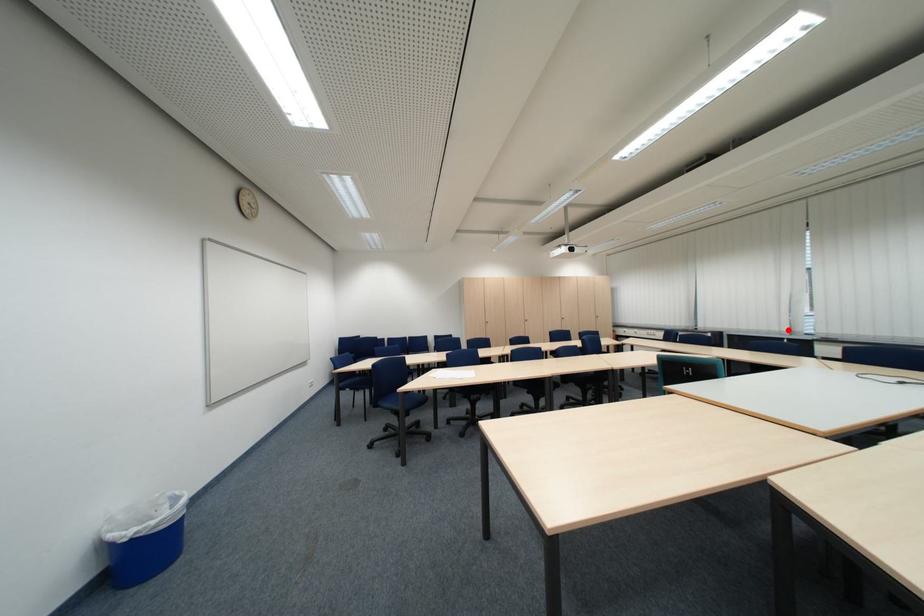
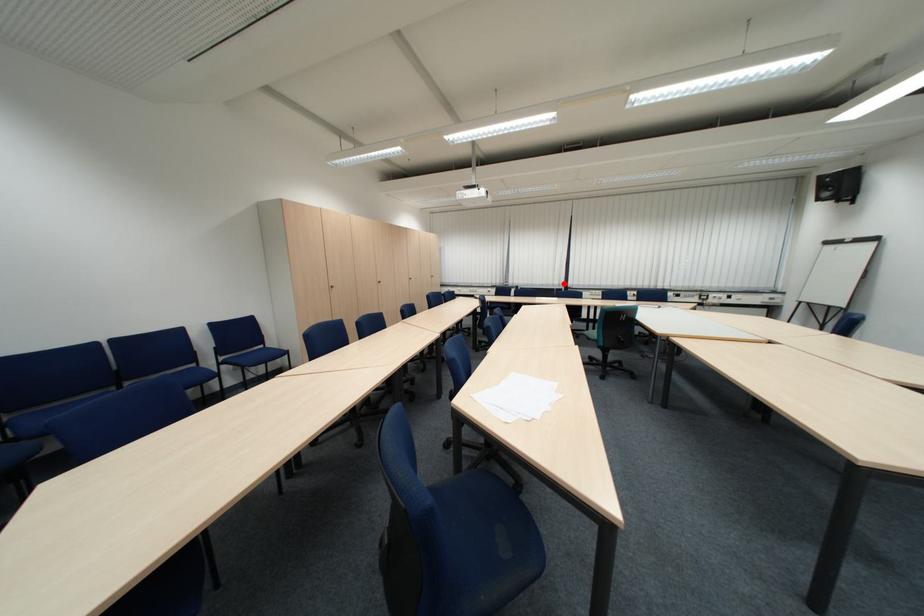
I am providing you with two images of the same scene from different viewpoints. A red point is marked on the first image and another point is marked on the second image. Is the red point in image1 aligned with the point shown in image2?

Yes